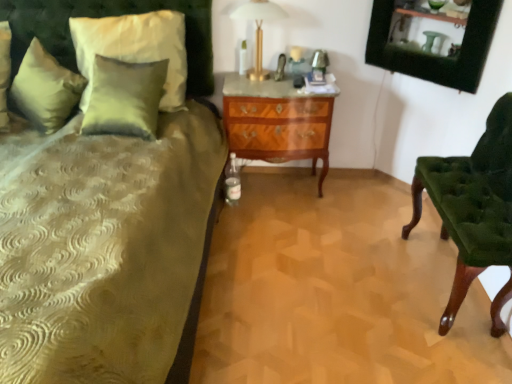
I want to click on vacant space in between mahogany wood drawer at center and velvet green chair at right, so click(x=345, y=234).